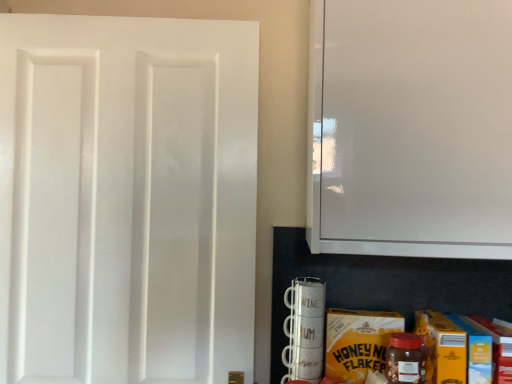
Question: Considering the relative sizes of yellow cardboard carton at lower right and white matte door at left in the image provided, is yellow cardboard carton at lower right taller than white matte door at left?

Choices:
 (A) no
 (B) yes

Answer: (A)

Question: Is yellow cardboard carton at lower right positioned with its back to white matte door at left?

Choices:
 (A) yes
 (B) no

Answer: (B)

Question: Is yellow cardboard carton at lower right closer to camera compared to white matte door at left?

Choices:
 (A) no
 (B) yes

Answer: (B)

Question: Is yellow cardboard carton at lower right far away from white matte door at left?

Choices:
 (A) yes
 (B) no

Answer: (B)

Question: From the image's perspective, would you say yellow cardboard carton at lower right is positioned over white matte door at left?

Choices:
 (A) no
 (B) yes

Answer: (A)

Question: Based on their positions, is yellow cardboard carton at lower right located to the left or right of white matte door at left?

Choices:
 (A) left
 (B) right

Answer: (B)

Question: Considering the positions of yellow cardboard carton at lower right and white matte door at left in the image, is yellow cardboard carton at lower right taller or shorter than white matte door at left?

Choices:
 (A) short
 (B) tall

Answer: (A)

Question: Do you think yellow cardboard carton at lower right is within white matte door at left, or outside of it?

Choices:
 (A) inside
 (B) outside

Answer: (B)

Question: Is point (378, 334) positioned closer to the camera than point (163, 258)?

Choices:
 (A) farther
 (B) closer

Answer: (B)

Question: From a real-world perspective, is white matte door at left physically located above or below white glossy cabinet at upper right?

Choices:
 (A) below
 (B) above

Answer: (A)

Question: Considering the positions of white matte door at left and white glossy cabinet at upper right in the image, is white matte door at left taller or shorter than white glossy cabinet at upper right?

Choices:
 (A) tall
 (B) short

Answer: (A)

Question: Looking at their shapes, would you say white matte door at left is wider or thinner than white glossy cabinet at upper right?

Choices:
 (A) thin
 (B) wide

Answer: (A)

Question: In the image, is white matte door at left positioned in front of or behind white glossy cabinet at upper right?

Choices:
 (A) behind
 (B) front

Answer: (A)

Question: Looking at their shapes, would you say yellow cardboard carton at lower right is wider or thinner than translucent plastic jar at lower right?

Choices:
 (A) thin
 (B) wide

Answer: (A)

Question: Is yellow cardboard carton at lower right in front of or behind translucent plastic jar at lower right in the image?

Choices:
 (A) front
 (B) behind

Answer: (B)